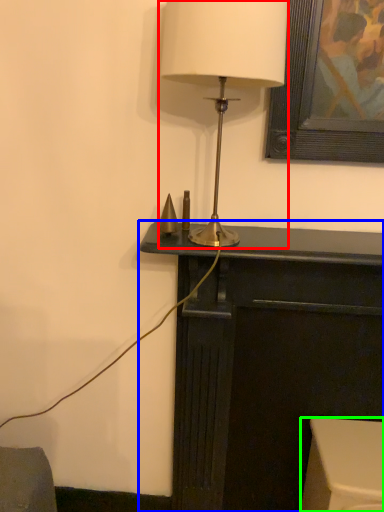
Question: Considering the real-world distances, which object is farthest from lamp (highlighted by a red box)? furniture (highlighted by a blue box) or furniture (highlighted by a green box)?

Choices:
 (A) furniture
 (B) furniture

Answer: (B)